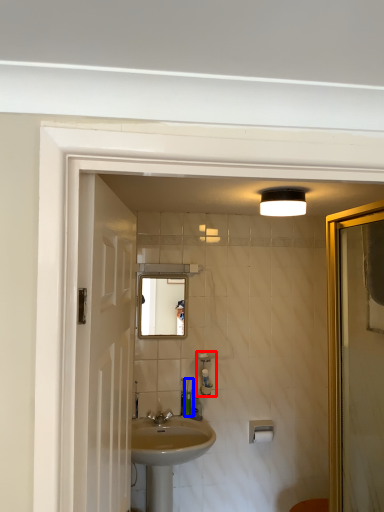
Question: Which object is further to the camera taking this photo, soap dispenser (highlighted by a red box) or toiletry (highlighted by a blue box)?

Choices:
 (A) soap dispenser
 (B) toiletry

Answer: (B)